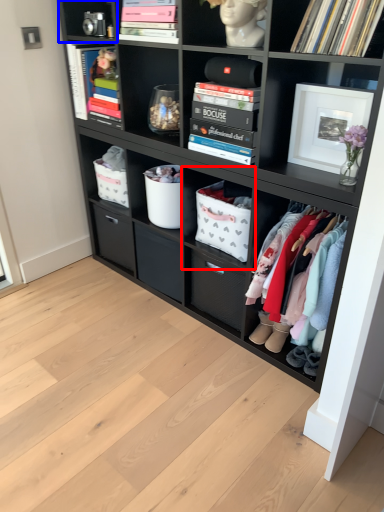
Question: Which of the following is the closest to the observer, shelf (highlighted by a red box) or cabinet (highlighted by a blue box)?

Choices:
 (A) shelf
 (B) cabinet

Answer: (A)